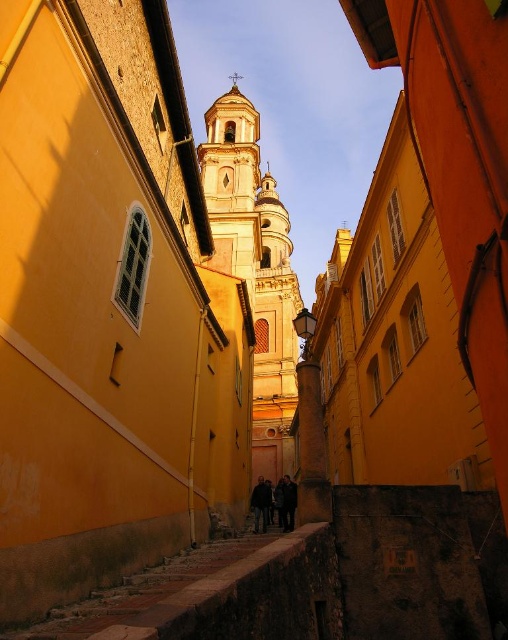
How much distance is there between dark gray fabric coat at center and dark blue jeans at center?

1.91 meters

Between point (289, 531) and point (259, 490), which one is positioned in front?

Positioned in front is point (289, 531).

Find the location of `dark gray fabric coat at center`. dark gray fabric coat at center is located at coordinates (285, 500).

Which of these two, smooth gold tower at center or dark gray fabric coat at center, stands taller?

smooth gold tower at center is taller.

Is smooth gold tower at center to the right of dark gray fabric coat at center from the viewer's perspective?

Yes, smooth gold tower at center is to the right of dark gray fabric coat at center.

The height and width of the screenshot is (640, 508). I want to click on smooth gold tower at center, so click(255, 268).

Is smooth gold tower at center wider than dark clothing figure at center?

→ Indeed, smooth gold tower at center has a greater width compared to dark clothing figure at center.

Is point (205, 160) positioned after point (287, 476)?

That is True.

Where is `smooth gold tower at center`? smooth gold tower at center is located at coordinates (255, 268).